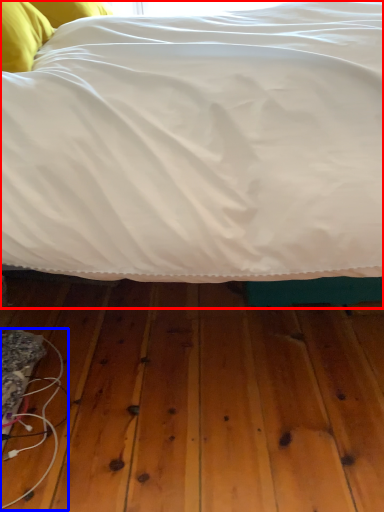
Question: Which object is further to the camera taking this photo, bed (highlighted by a red box) or wire (highlighted by a blue box)?

Choices:
 (A) bed
 (B) wire

Answer: (B)